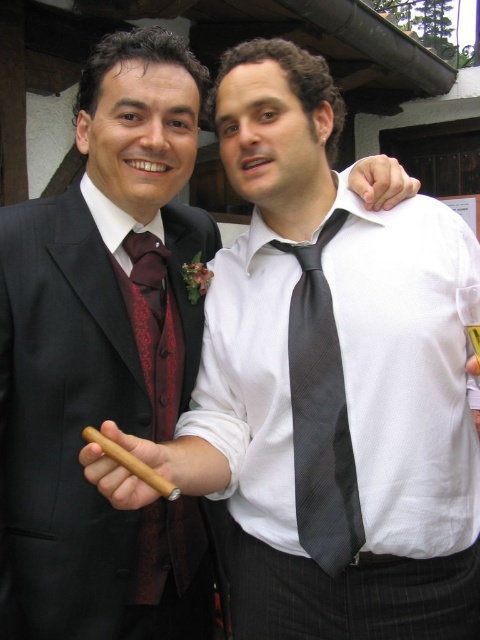
Question: Which point is closer to the camera?

Choices:
 (A) dark gray textured tie at center
 (B) matte burgundy tie at center

Answer: (A)

Question: Does black satin suit at left appear on the left side of dark gray textured tie at center?

Choices:
 (A) yes
 (B) no

Answer: (A)

Question: Can you confirm if dark gray textured tie at center is positioned to the right of matte burgundy tie at center?

Choices:
 (A) no
 (B) yes

Answer: (B)

Question: Which point is closer to the camera?

Choices:
 (A) black satin suit at left
 (B) matte burgundy tie at center

Answer: (A)

Question: From the image, what is the correct spatial relationship of black satin suit at left in relation to matte burgundy tie at center?

Choices:
 (A) right
 (B) left

Answer: (B)

Question: Which point appears farthest from the camera in this image?

Choices:
 (A) (166, 536)
 (B) (324, 326)
 (C) (84, 260)

Answer: (A)